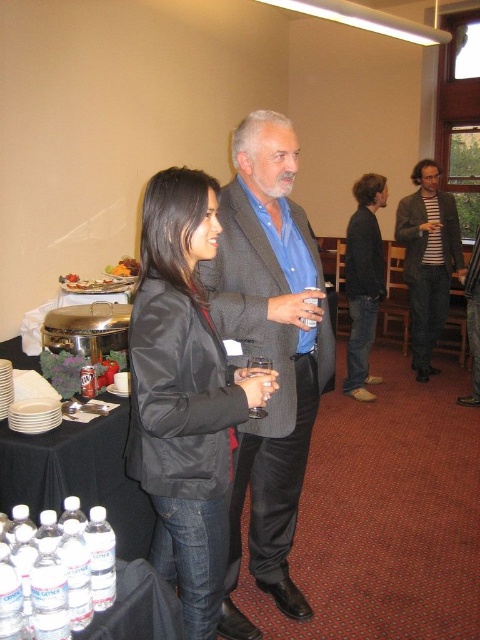
You are at a social event and need to place a small name tag on either the satin black blazer at center or the smooth brown bread at left. Which object would be more suitable for attaching the name tag based on their sizes?

The satin black blazer at center is taller than the smooth brown bread at left, so it would be more suitable for attaching the name tag as it provides a larger surface area.

You are at the point marked as (184, 396) in the image. What object is exactly at this point?

The satin black blazer at center is exactly at point (184, 396).

You are a photographer at the event and want to capture a photo of the two objects mentioned. Since the satin black blazer at center is taller than the clear glass wine glass at center, will the blazer block the view of the glass in the photo?

The satin black blazer at center is taller than the clear glass wine glass at center, so it may block the view of the glass depending on their positions. However, since both are at center, adjusting the angle or moving slightly could ensure both are visible.